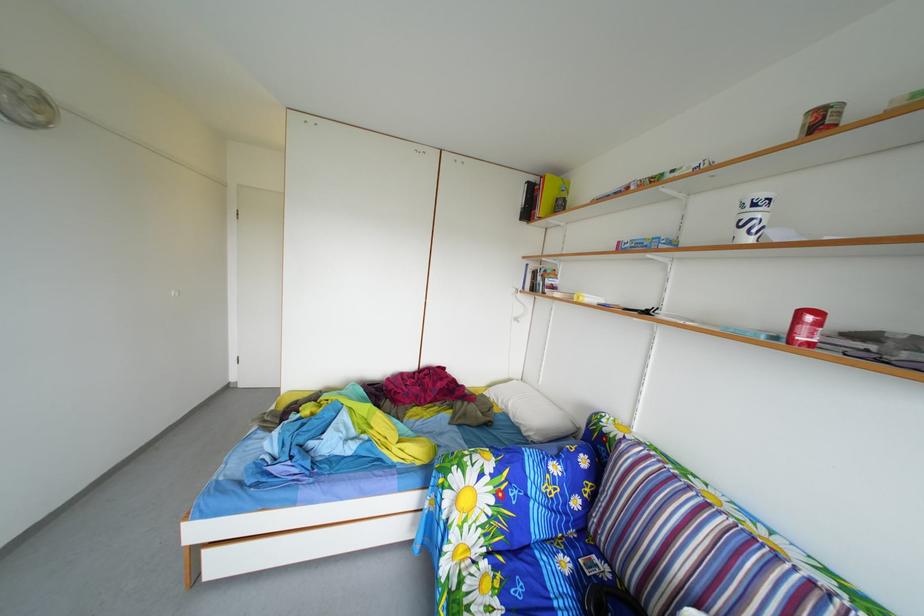
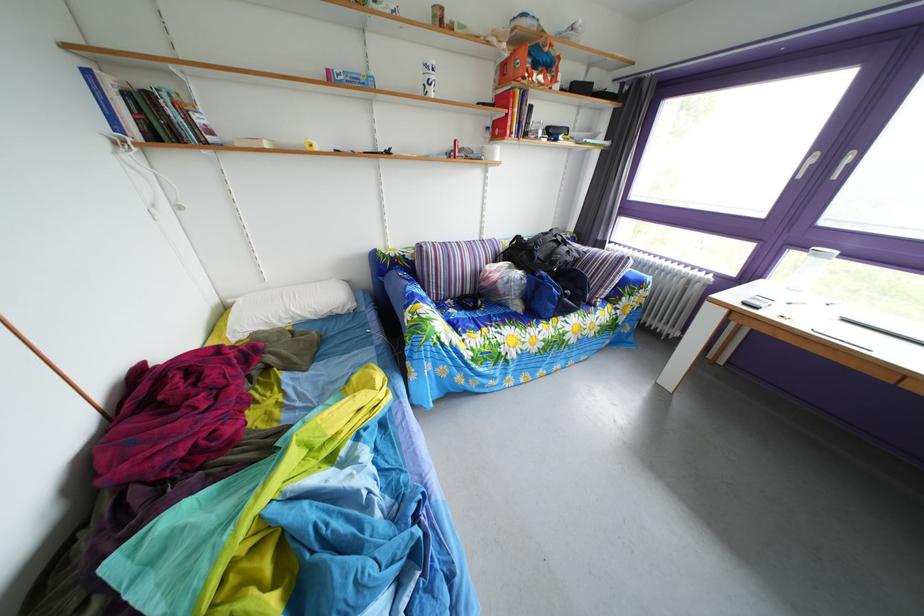
Where in the second image is the point corresponding to (x=565, y=460) from the first image?

(417, 290)